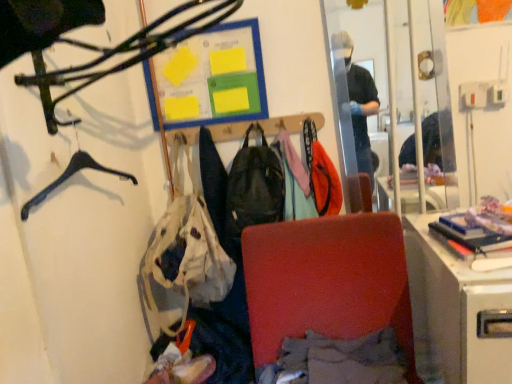
This screenshot has height=384, width=512. In order to click on white fabric handbag at center in this screenshot , I will do `click(182, 258)`.

What do you see at coordinates (182, 258) in the screenshot? This screenshot has width=512, height=384. I see `white fabric handbag at center` at bounding box center [182, 258].

The width and height of the screenshot is (512, 384). Describe the element at coordinates (327, 281) in the screenshot. I see `velvet red chair at center` at that location.

What do you see at coordinates (450, 243) in the screenshot?
I see `hardcover book at right` at bounding box center [450, 243].

At what (x,y) coordinates should I click in order to perform the action: click on matte black hanger at upper left. Please return your answer as a coordinate pair (x, y). Looking at the image, I should click on (118, 53).

The image size is (512, 384). What do you see at coordinates (118, 53) in the screenshot? I see `matte black hanger at upper left` at bounding box center [118, 53].

Identify the location of matte black backpack at center. This screenshot has height=384, width=512. (254, 187).

Is matte black backpack at center surrounded by velvet red chair at center?

No.

From the image's perspective, which one is positioned higher, velvet red chair at center or matte black backpack at center?

matte black backpack at center.

Considering the sizes of objects velvet red chair at center and matte black backpack at center in the image provided, who is taller, velvet red chair at center or matte black backpack at center?

velvet red chair at center.

In the image, is velvet red chair at center positioned in front of or behind matte black backpack at center?

Clearly, velvet red chair at center is in front of matte black backpack at center.

Looking at this image, can you confirm if clear glass mirror at upper right is positioned to the left of white glossy desk at lower right?

Yes.

How many degrees apart are the facing directions of clear glass mirror at upper right and white glossy desk at lower right?

clear glass mirror at upper right and white glossy desk at lower right are facing 2.42 degrees away from each other.

From the image's perspective, is clear glass mirror at upper right located beneath white glossy desk at lower right?

Incorrect, from the image's perspective, clear glass mirror at upper right is higher than white glossy desk at lower right.

Between clear glass mirror at upper right and white glossy desk at lower right, which one is positioned in front?

white glossy desk at lower right.

Consider the image. How many degrees apart are the facing directions of matte black backpack at center and matte black hanger at upper left?

91.1 degrees.

Is matte black backpack at center at the right side of matte black hanger at upper left?

Yes, matte black backpack at center is to the right of matte black hanger at upper left.

Is point (247, 216) positioned before point (85, 85)?

No.

Which object is more forward, matte black backpack at center or matte black hanger at upper left?

matte black hanger at upper left is in front.

From a real-world perspective, is white fabric handbag at center physically located above or below hardcover book at right?

In terms of real-world spatial position, white fabric handbag at center is above hardcover book at right.

From the image's perspective, is white fabric handbag at center on top of hardcover book at right?

No.

Is hardcover book at right completely or partially inside white fabric handbag at center?

No, hardcover book at right is not surrounded by white fabric handbag at center.

Does white fabric handbag at center turn towards hardcover book at right?

No.

Can clear glass mirror at upper right be found inside hardcover book at right?

Definitely not — clear glass mirror at upper right is not inside hardcover book at right.

Could you tell me if hardcover book at right is turned towards clear glass mirror at upper right?

No, hardcover book at right does not turn towards clear glass mirror at upper right.

Considering the sizes of objects hardcover book at right and clear glass mirror at upper right in the image provided, who is wider, hardcover book at right or clear glass mirror at upper right?

hardcover book at right is wider.

How distant is clear glass mirror at upper right from velvet red chair at center?

clear glass mirror at upper right is 55.64 centimeters away from velvet red chair at center.

Would you say clear glass mirror at upper right is inside or outside velvet red chair at center?

clear glass mirror at upper right exists outside the volume of velvet red chair at center.

Considering the positions of objects clear glass mirror at upper right and velvet red chair at center in the image provided, who is more to the right, clear glass mirror at upper right or velvet red chair at center?

clear glass mirror at upper right.

Consider the image. Is clear glass mirror at upper right positioned far away from velvet red chair at center?

That's not correct — clear glass mirror at upper right is a little close to velvet red chair at center.

Is matte black hanger at upper left oriented towards matte black backpack at center?

No.

Which of these two, matte black hanger at upper left or matte black backpack at center, stands shorter?

matte black hanger at upper left is shorter.

Which point is more distant from viewer, (225, 3) or (282, 191)?

The point (282, 191) is farther from the camera.

Which of these two, matte black hanger at upper left or matte black backpack at center, is thinner?

matte black backpack at center is thinner.

Locate an element on the screen. This screenshot has width=512, height=384. backpack above the velvet red chair at center (from the image's perspective) is located at coordinates (254, 187).

Image resolution: width=512 pixels, height=384 pixels. Find the location of `mirror behind the white glossy desk at lower right`. mirror behind the white glossy desk at lower right is located at coordinates (402, 79).

Which object lies nearer to the anchor point matte black hanger at upper left, matte black backpack at center or hardcover book at right?

Among the two, matte black backpack at center is located nearer to matte black hanger at upper left.

Based on their spatial positions, is matte black hanger at upper left or velvet red chair at center closer to white fabric handbag at center?

Based on the image, velvet red chair at center appears to be nearer to white fabric handbag at center.

Which object lies further to the anchor point matte black backpack at center, matte black hanger at upper left or clear glass mirror at upper right?

Based on the image, matte black hanger at upper left appears to be further to matte black backpack at center.

Looking at the image, which one is located further to white glossy desk at lower right, matte black hanger at upper left or matte black backpack at center?

matte black hanger at upper left is positioned further to the anchor white glossy desk at lower right.

Based on their spatial positions, is matte black backpack at center or white fabric handbag at center further from velvet red chair at center?

white fabric handbag at center.

Looking at this image, when comparing their distances from clear glass mirror at upper right, does velvet red chair at center or hardcover book at right seem closer?

hardcover book at right lies closer to clear glass mirror at upper right than the other object.

Looking at the image, which one is located closer to hardcover book at right, velvet red chair at center or matte black backpack at center?

velvet red chair at center is positioned closer to the anchor hardcover book at right.

Considering their positions, is matte black hanger at upper left positioned further to hardcover book at right than white fabric handbag at center?

Among the two, matte black hanger at upper left is located further to hardcover book at right.

Identify the location of backpack between matte black hanger at upper left and velvet red chair at center from top to bottom. Image resolution: width=512 pixels, height=384 pixels. (254, 187).

Where is `handbag situated between matte black hanger at upper left and white glossy desk at lower right from left to right`? Image resolution: width=512 pixels, height=384 pixels. handbag situated between matte black hanger at upper left and white glossy desk at lower right from left to right is located at coordinates (182, 258).

The image size is (512, 384). What are the coordinates of `handbag located between matte black hanger at upper left and hardcover book at right in the left-right direction` in the screenshot? It's located at (182, 258).

Where is `desk between velvet red chair at center and matte black backpack at center along the z-axis`? The width and height of the screenshot is (512, 384). desk between velvet red chair at center and matte black backpack at center along the z-axis is located at coordinates (456, 312).